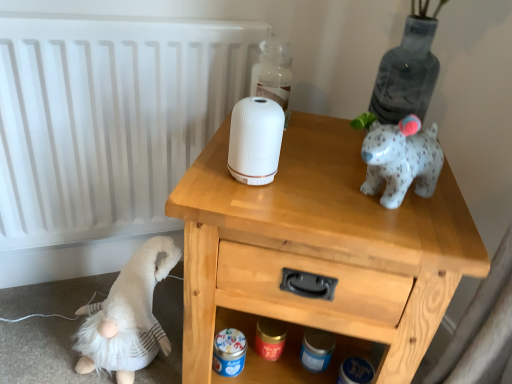
Find the location of `vacant space to the right of white matte speaker at center`. vacant space to the right of white matte speaker at center is located at coordinates (319, 183).